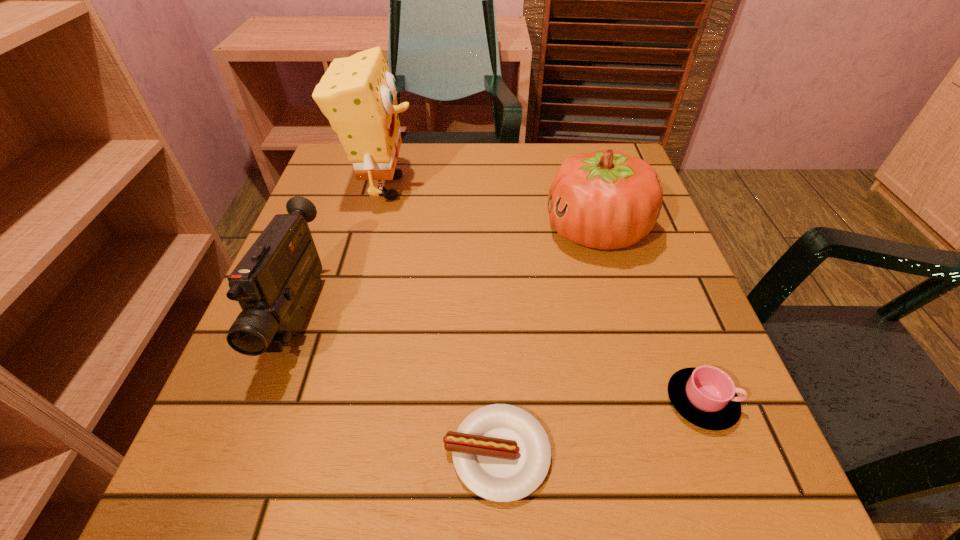
At what (x,y) coordinates should I click in order to perform the action: click on vacant region that satisfies the following two spatial constraints: 1. on the side of the pumpkin with the cute face; 2. on the front side of the third object from right to left. Please return your answer as a coordinate pair (x, y). This screenshot has height=540, width=960. Looking at the image, I should click on (660, 453).

Where is `vacant area that satisfies the following two spatial constraints: 1. on the face of the sausage; 2. on the right side of the sponge`? The height and width of the screenshot is (540, 960). vacant area that satisfies the following two spatial constraints: 1. on the face of the sausage; 2. on the right side of the sponge is located at coordinates 315,453.

Where is `free space in the image that satisfies the following two spatial constraints: 1. on the face of the sponge; 2. on the front-facing side of the camcorder`? free space in the image that satisfies the following two spatial constraints: 1. on the face of the sponge; 2. on the front-facing side of the camcorder is located at coordinates (350, 317).

In order to click on free location that satisfies the following two spatial constraints: 1. on the front-facing side of the shortest object; 2. on the left side of the camcorder in this screenshot , I will do `click(249, 453)`.

At what (x,y) coordinates should I click in order to perform the action: click on free space that satisfies the following two spatial constraints: 1. on the side of the pumpkin with the cute face; 2. on the front-facing side of the camcorder. Please return your answer as a coordinate pair (x, y). The image size is (960, 540). Looking at the image, I should click on (621, 317).

Where is `vacant region that satisfies the following two spatial constraints: 1. on the face of the shortest object; 2. on the left side of the sponge`? The height and width of the screenshot is (540, 960). vacant region that satisfies the following two spatial constraints: 1. on the face of the shortest object; 2. on the left side of the sponge is located at coordinates [x=315, y=453].